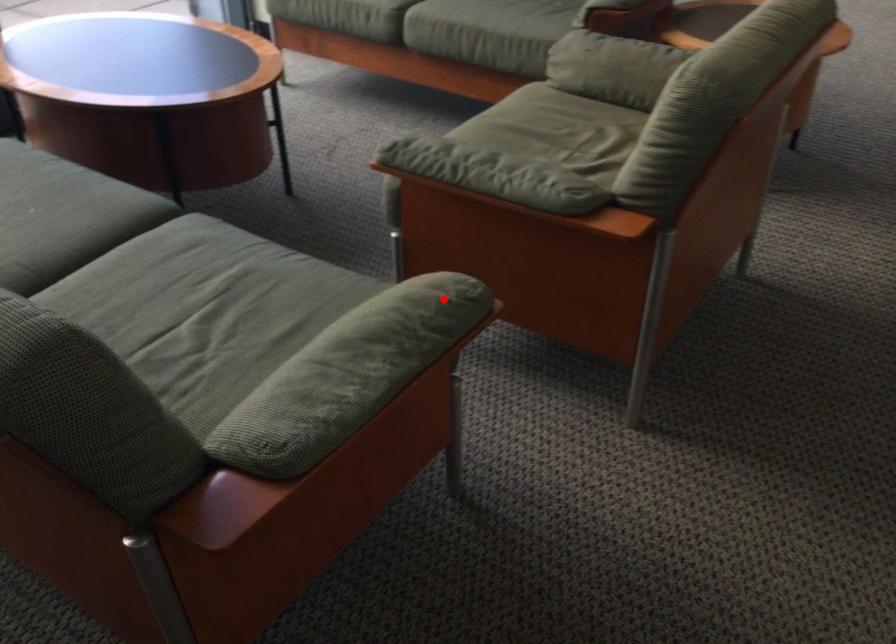
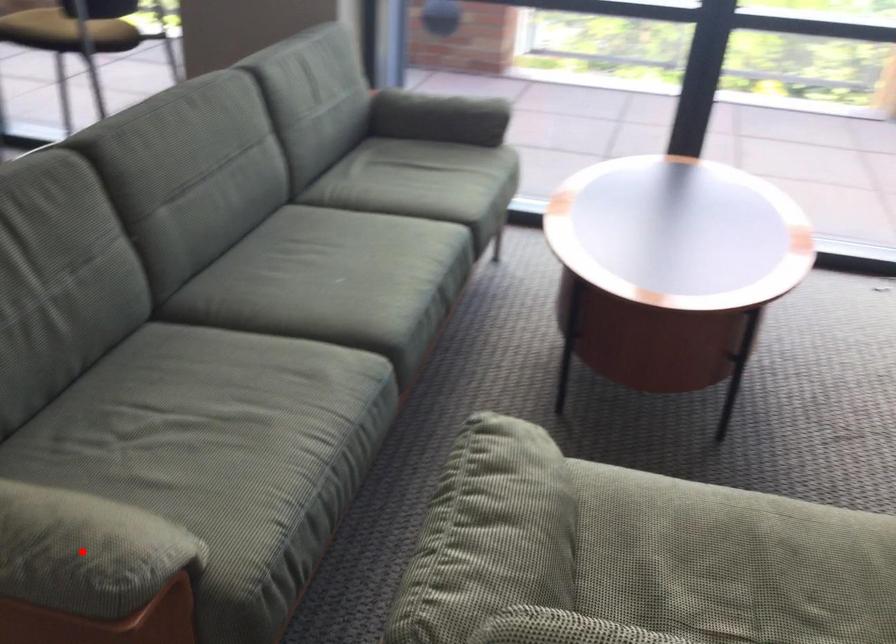
I am providing you with two images of the same scene from different viewpoints. A red point is marked on the first image and another point is marked on the second image. Do the highlighted points in image1 and image2 indicate the same real-world spot?

Yes